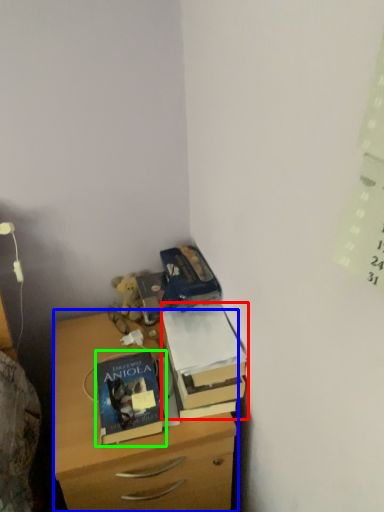
Question: Based on their relative distances, which object is farther from box (highlighted by a red box)? Choose from chest of drawers (highlighted by a blue box) and book (highlighted by a green box).

Choices:
 (A) chest of drawers
 (B) book

Answer: (A)